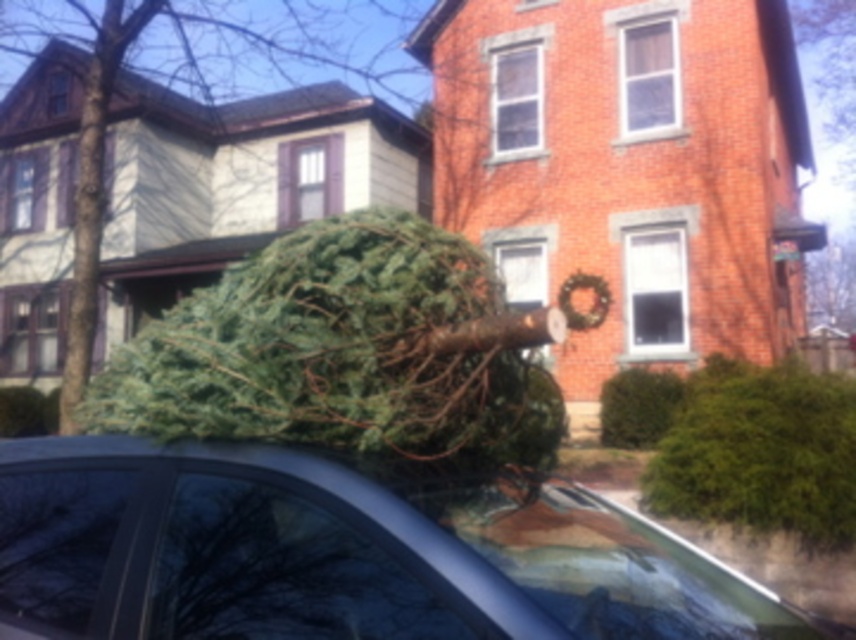
Which is above, metallic gray car at center or green natural tree at center?

green natural tree at center is higher up.

Image resolution: width=856 pixels, height=640 pixels. Describe the element at coordinates (337, 554) in the screenshot. I see `metallic gray car at center` at that location.

I want to click on metallic gray car at center, so click(337, 554).

Does green rough textured tree at center have a greater width compared to brown shingles at upper left?

Correct, the width of green rough textured tree at center exceeds that of brown shingles at upper left.

In order to click on green rough textured tree at center in this screenshot , I will do [164, 193].

What do you see at coordinates (164, 193) in the screenshot?
I see `green rough textured tree at center` at bounding box center [164, 193].

You are a GUI agent. You are given a task and a screenshot of the screen. Output one action in this format:
    pyautogui.click(x=<x>, y=<y>)
    Task: Click on the green rough textured tree at center
    The width and height of the screenshot is (856, 640).
    Given the screenshot: What is the action you would take?
    pyautogui.click(x=164, y=193)

Is green natural tree at center to the right of brick at upper right from the viewer's perspective?

Incorrect, green natural tree at center is not on the right side of brick at upper right.

Between point (262, 323) and point (438, 1), which one is positioned behind?

Positioned behind is point (438, 1).

Between point (437, 326) and point (621, 20), which one is positioned in front?

Point (437, 326)

Identify the location of green natural tree at center. (339, 353).